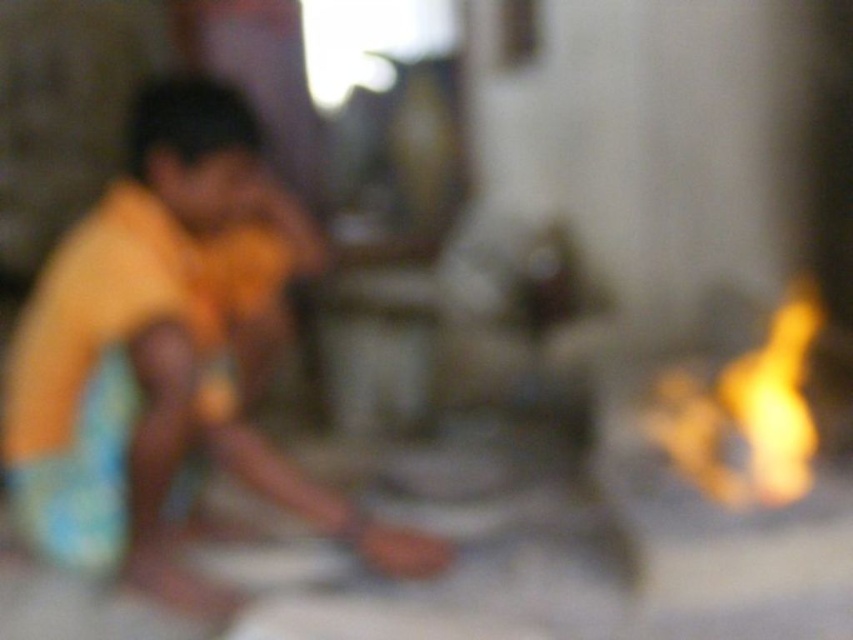
Is yellow cotton shirt at left below flame/yellow-orange at right?

No, yellow cotton shirt at left is not below flame/yellow-orange at right.

Is yellow cotton shirt at left thinner than flame/yellow-orange at right?

No.

Identify the location of yellow cotton shirt at left. (166, 356).